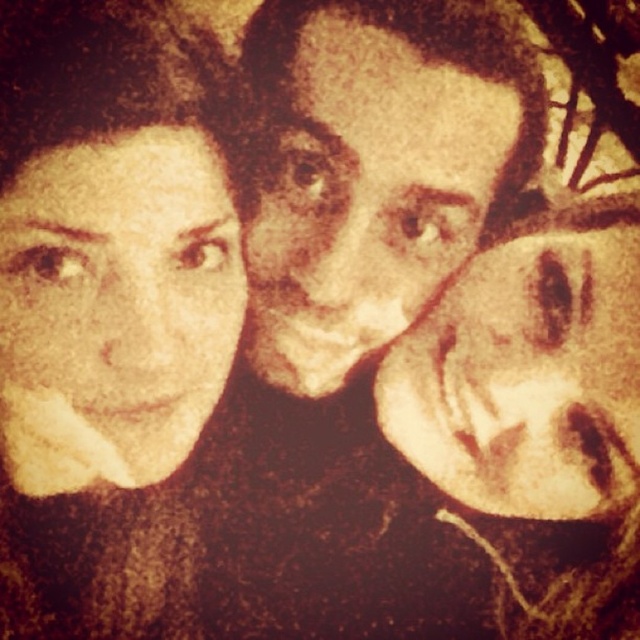
Can you confirm if matte yellow face at left is positioned above smooth beige face at right?

Indeed, matte yellow face at left is positioned over smooth beige face at right.

Does matte yellow face at left lie behind smooth beige face at right?

That is False.

Does point (128, 371) come closer to viewer compared to point (605, 252)?

Yes, point (128, 371) is closer to viewer.

The image size is (640, 640). In order to click on matte yellow face at left in this screenshot , I will do `click(115, 308)`.

Is point (154, 216) more distant than point (412, 227)?

No, (154, 216) is in front of (412, 227).

This screenshot has width=640, height=640. Describe the element at coordinates (115, 308) in the screenshot. I see `matte yellow face at left` at that location.

You are a GUI agent. You are given a task and a screenshot of the screen. Output one action in this format:
    pyautogui.click(x=<x>, y=<y>)
    Task: Click on the matte yellow face at left
    
    Given the screenshot: What is the action you would take?
    pyautogui.click(x=115, y=308)

Image resolution: width=640 pixels, height=640 pixels. In order to click on brown matte face at center in this screenshot , I will do `click(365, 196)`.

Where is `brown matte face at center`? brown matte face at center is located at coordinates (365, 196).